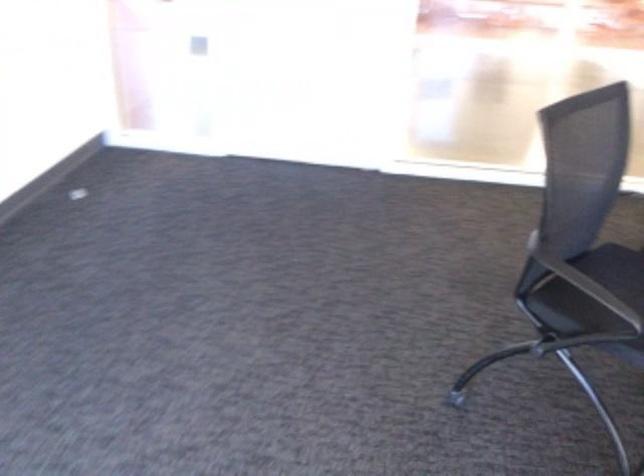
This screenshot has height=476, width=644. What are the coordinates of `black chair armrest` in the screenshot? It's located at (594, 292).